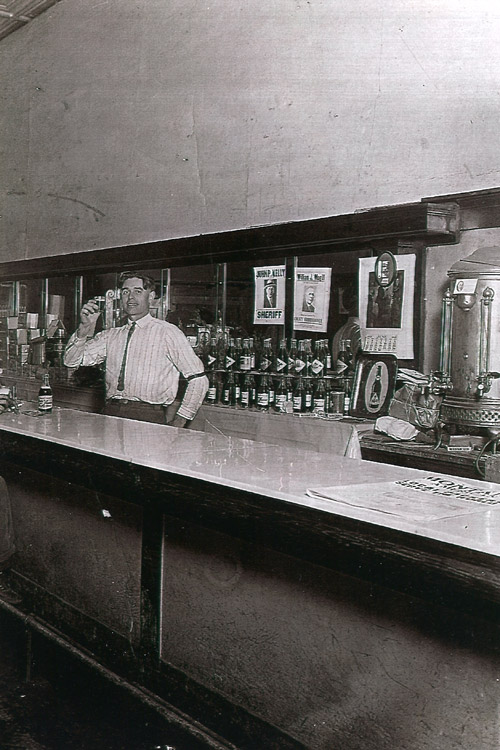
At what (x,y) coordinates should I click in order to perform the action: click on keg / dispenser. Please return your answer as a coordinate pair (x, y). This screenshot has width=500, height=750. Looking at the image, I should click on coord(466,332).